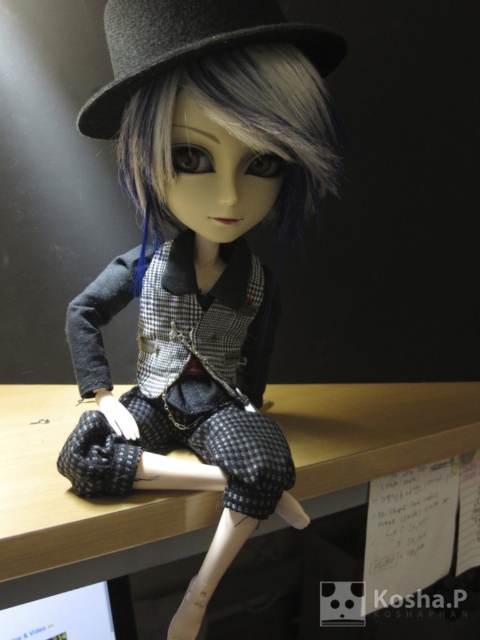
Between wooden table at center and gray felt fedora at upper center, which one has more height?

With more height is wooden table at center.

Who is lower down, wooden table at center or gray felt fedora at upper center?

wooden table at center is lower down.

At what (x,y) coordinates should I click in order to perform the action: click on wooden table at center. Please return your answer as a coordinate pair (x, y). Image resolution: width=480 pixels, height=640 pixels. Looking at the image, I should click on (76, 508).

The image size is (480, 640). Identify the location of matte black doll at center. (201, 250).

Who is shorter, matte black doll at center or wooden table at center?

Standing shorter between the two is wooden table at center.

Measure the distance between point (243, 426) and camera.

The distance of point (243, 426) from camera is 26.43 inches.

Where is `matte black doll at center`? matte black doll at center is located at coordinates (201, 250).

From the picture: Can you confirm if gray matte hair at center is positioned to the right of gray felt fedora at upper center?

Indeed, gray matte hair at center is positioned on the right side of gray felt fedora at upper center.

Between point (229, 74) and point (273, 1), which one is positioned behind?

The point (273, 1) is more distant.

This screenshot has height=640, width=480. Identify the location of gray matte hair at center. (231, 132).

Locate an element on the screen. gray matte hair at center is located at coordinates [x=231, y=132].